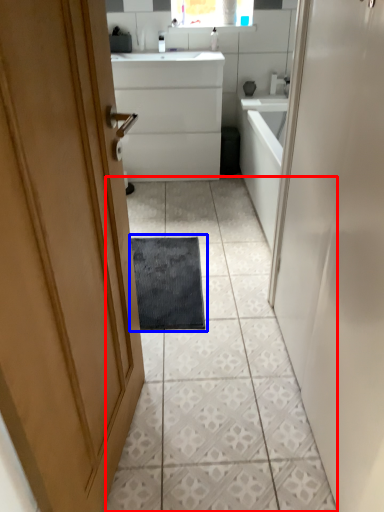
Question: Which object appears farthest to the camera in this image, ceramic tile (highlighted by a red box) or bath mat (highlighted by a blue box)?

Choices:
 (A) ceramic tile
 (B) bath mat

Answer: (B)